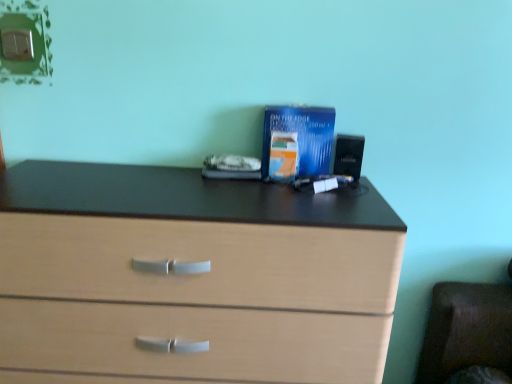
Question: From a real-world perspective, is light wood chest of drawers at center below blue glossy paperback book at center, which is the 2th paperback book from back to front?

Choices:
 (A) yes
 (B) no

Answer: (A)

Question: Is light wood chest of drawers at center positioned far away from blue glossy paperback book at center, the first paperback book positioned from the front?

Choices:
 (A) no
 (B) yes

Answer: (A)

Question: Is light wood chest of drawers at center in front of blue glossy paperback book at center, the first paperback book positioned from the front?

Choices:
 (A) no
 (B) yes

Answer: (B)

Question: Can we say light wood chest of drawers at center lies outside blue glossy paperback book at center, the first paperback book positioned from the front?

Choices:
 (A) yes
 (B) no

Answer: (A)

Question: Is blue glossy paperback book at center, the first paperback book positioned from the front, a part of light wood chest of drawers at center?

Choices:
 (A) no
 (B) yes

Answer: (A)

Question: Is light wood chest of drawers at center in contact with blue glossy paperback book at center, which is the 2th paperback book from back to front?

Choices:
 (A) yes
 (B) no

Answer: (B)

Question: Does light wood chest of drawers at center have a greater width compared to blue glossy paperback book at center, which appears as the second paperback book when viewed from the front?

Choices:
 (A) no
 (B) yes

Answer: (B)

Question: Is light wood chest of drawers at center with blue glossy paperback book at center, which appears as the second paperback book when viewed from the front?

Choices:
 (A) no
 (B) yes

Answer: (A)

Question: From a real-world perspective, is light wood chest of drawers at center physically above blue glossy paperback book at center, the first paperback book positioned from the back?

Choices:
 (A) yes
 (B) no

Answer: (B)

Question: Would you say light wood chest of drawers at center contains blue glossy paperback book at center, the first paperback book positioned from the back?

Choices:
 (A) yes
 (B) no

Answer: (B)

Question: Would you say light wood chest of drawers at center is outside blue glossy paperback book at center, which appears as the second paperback book when viewed from the front?

Choices:
 (A) yes
 (B) no

Answer: (A)

Question: From the image's perspective, does light wood chest of drawers at center appear lower than blue glossy paperback book at center, which appears as the second paperback book when viewed from the front?

Choices:
 (A) yes
 (B) no

Answer: (A)

Question: Is blue glossy paperback book at center, the first paperback book positioned from the back, outside light wood chest of drawers at center?

Choices:
 (A) yes
 (B) no

Answer: (A)